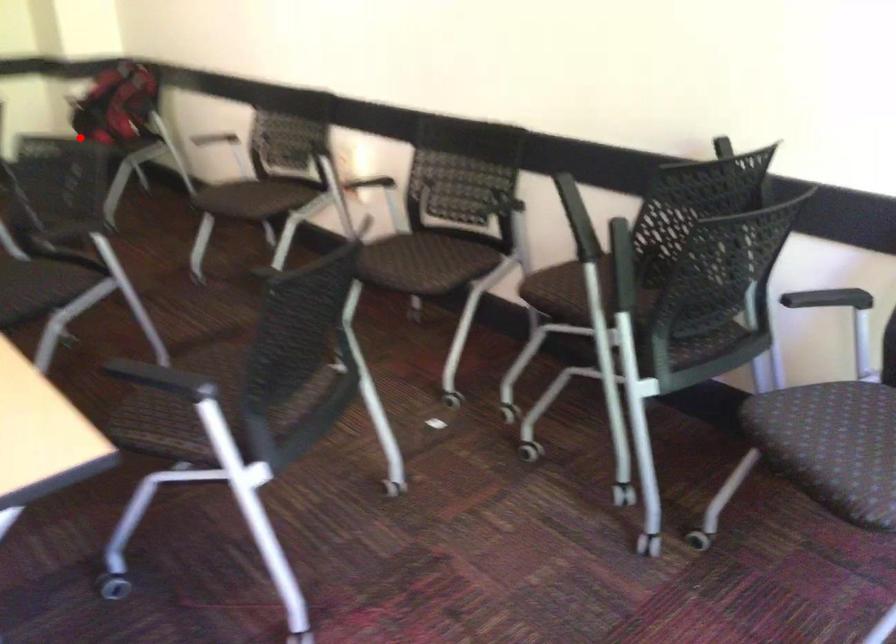
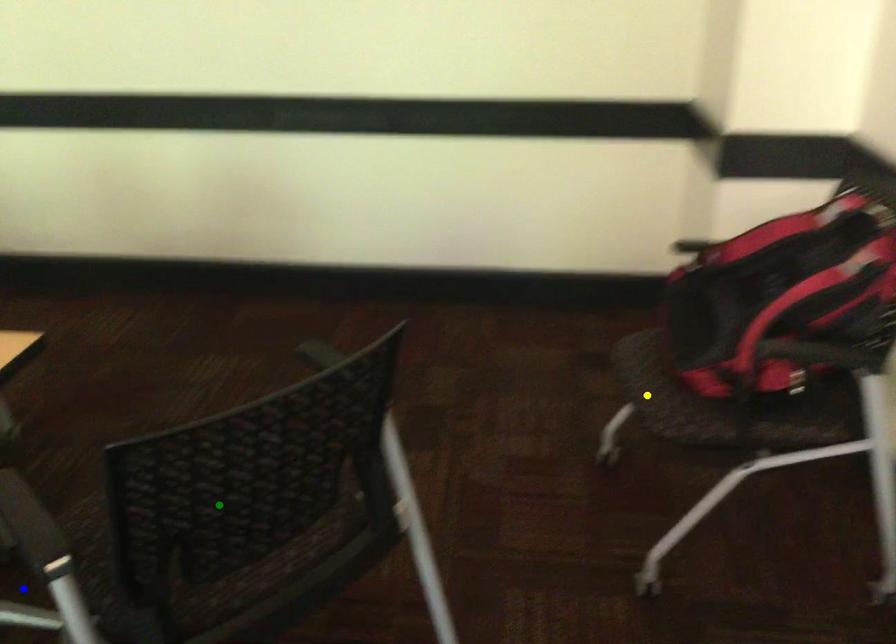
Question: I am providing you with two images of the same scene from different viewpoints. A red point is marked on the first image. You are given multiple points on the second image. Which spot in image 2 lines up with the point in image 1?

Choices:
 (A) blue point
 (B) green point
 (C) yellow point

Answer: (C)